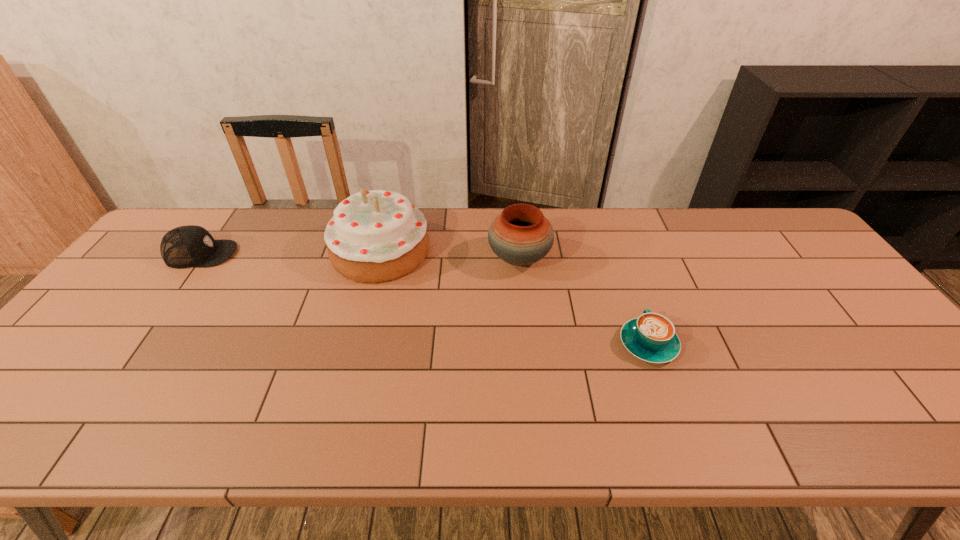
Find the location of a particular element. cake is located at coordinates (375, 236).

Where is `the tallest object`? The height and width of the screenshot is (540, 960). the tallest object is located at coordinates (375, 236).

You are a GUI agent. You are given a task and a screenshot of the screen. Output one action in this format:
    pyautogui.click(x=<x>, y=<y>)
    Task: Click on the pottery
    The image size is (960, 540).
    Given the screenshot: What is the action you would take?
    pyautogui.click(x=520, y=235)

The image size is (960, 540). I want to click on the second tallest object, so click(x=520, y=235).

Identify the location of cap. The height and width of the screenshot is (540, 960). (187, 246).

Identify the location of the leftmost object. The image size is (960, 540). (187, 246).

I want to click on the shortest object, so click(651, 337).

You are a GUI agent. You are given a task and a screenshot of the screen. Output one action in this format:
    pyautogui.click(x=<x>, y=<y>)
    Task: Click on the rightmost object
    The width and height of the screenshot is (960, 540).
    Given the screenshot: What is the action you would take?
    pyautogui.click(x=651, y=337)

The image size is (960, 540). Identify the location of vacant space located on the back of the cake. (391, 211).

Locate an element on the screen. This screenshot has height=540, width=960. vacant space located 0.230m on the front of the pottery is located at coordinates (528, 343).